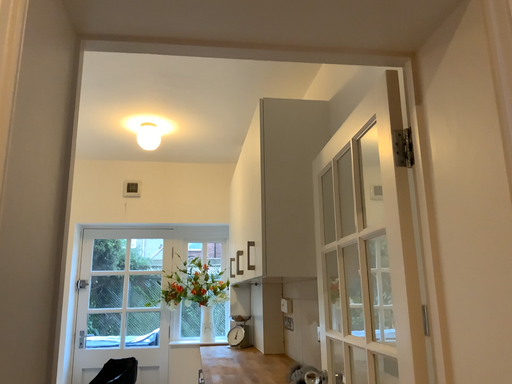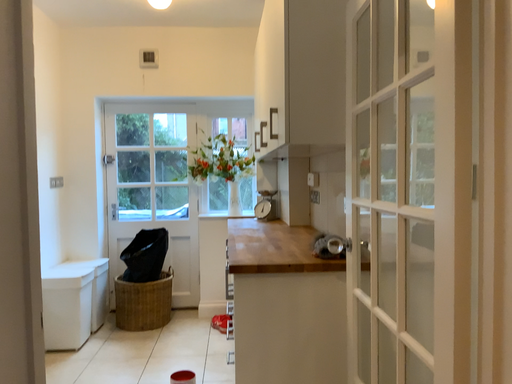
Question: How did the camera likely rotate when shooting the video?

Choices:
 (A) rotated upward
 (B) rotated downward

Answer: (B)